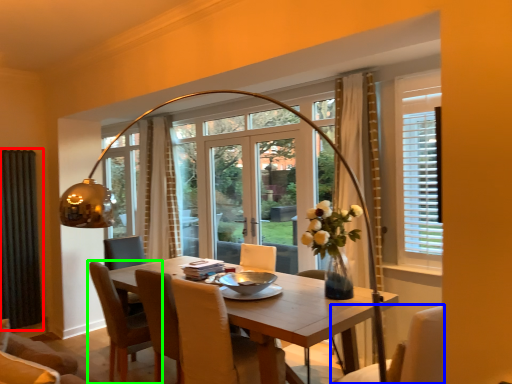
Question: Based on their relative distances, which object is farther from curtain (highlighted by a red box)? Choose from chair (highlighted by a blue box) and chair (highlighted by a green box).

Choices:
 (A) chair
 (B) chair

Answer: (A)